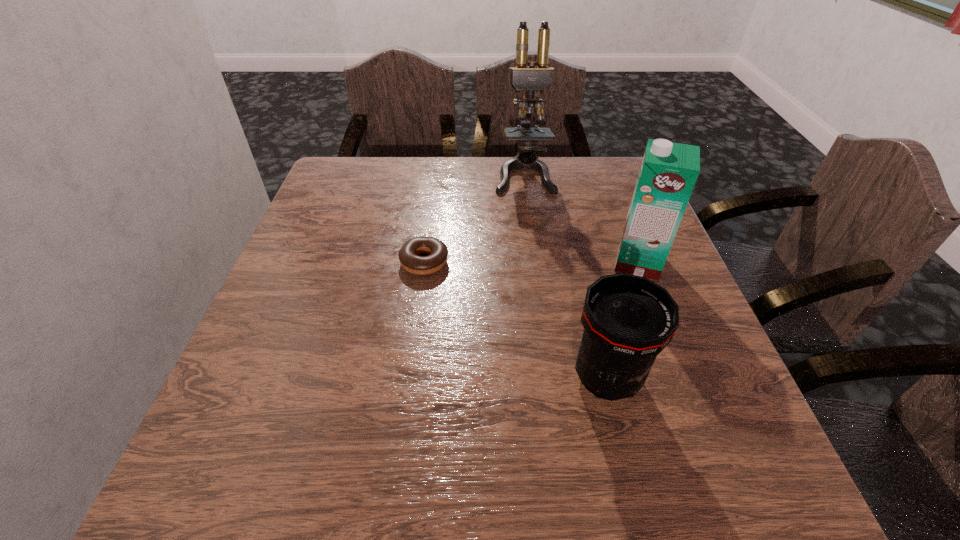
In order to click on free location at the far right corner in this screenshot , I will do `click(623, 160)`.

The height and width of the screenshot is (540, 960). In order to click on free space at the near right corner of the desktop in this screenshot , I will do `click(706, 462)`.

This screenshot has height=540, width=960. Identify the location of free point between the tallest object and the carton. (581, 218).

Where is `vacant area between the tallest object and the shortest object`? The width and height of the screenshot is (960, 540). vacant area between the tallest object and the shortest object is located at coordinates (474, 218).

The width and height of the screenshot is (960, 540). I want to click on free space between the farthest object and the second tallest object, so click(x=581, y=218).

I want to click on free area in between the tallest object and the nearest object, so tap(565, 276).

This screenshot has height=540, width=960. What are the coordinates of `empty location between the farthest object and the shortest object` in the screenshot? It's located at (474, 218).

The width and height of the screenshot is (960, 540). I want to click on free space between the farthest object and the third tallest object, so click(x=565, y=276).

This screenshot has width=960, height=540. I want to click on vacant point located between the leftmost object and the rightmost object, so click(531, 262).

Identify the location of free spot between the rightmost object and the farthest object. (581, 218).